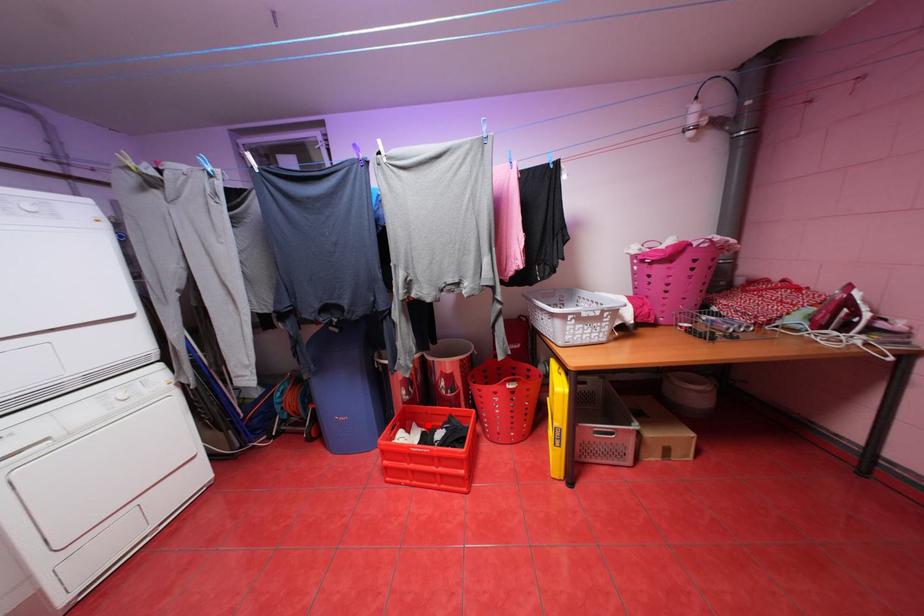
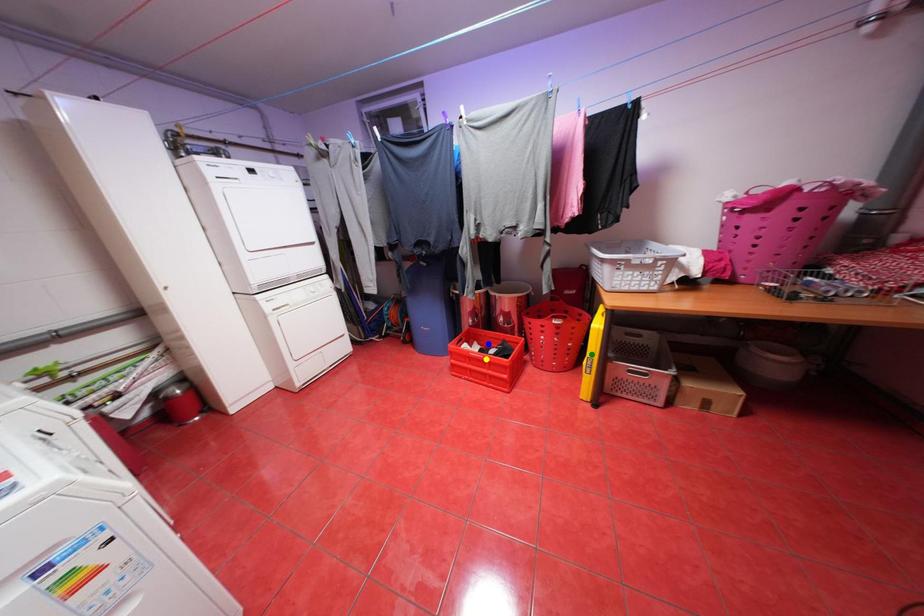
Question: I am providing you with two images of the same scene from different viewpoints. A red point is marked on the first image. You are given multiple points on the second image. Which mark in image 2 goes with the point in image 1?

Choices:
 (A) yellow point
 (B) green point
 (C) blue point

Answer: (C)